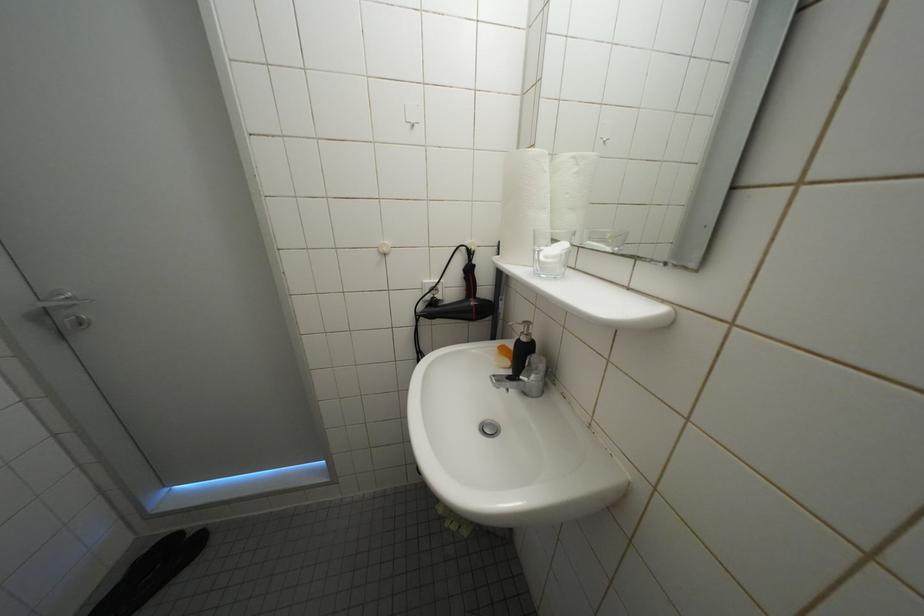
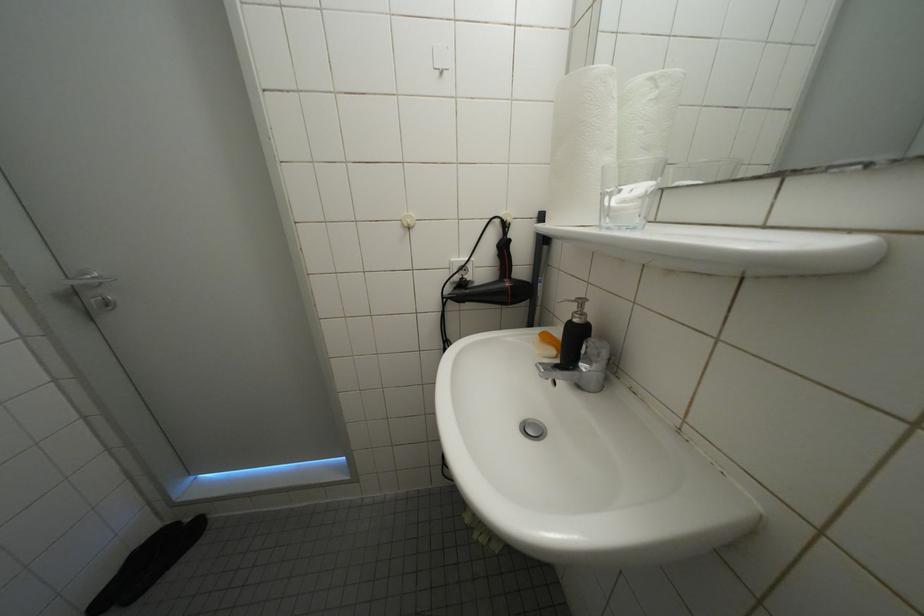
Question: In a continuous first-person perspective shot, in which direction is the camera moving?

Choices:
 (A) Left
 (B) Right
 (C) Forward
 (D) Backward

Answer: (C)